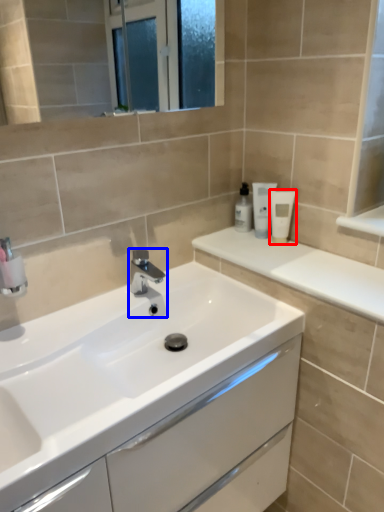
Question: Which point is closer to the camera, toiletry (highlighted by a red box) or tap (highlighted by a blue box)?

Choices:
 (A) toiletry
 (B) tap

Answer: (B)